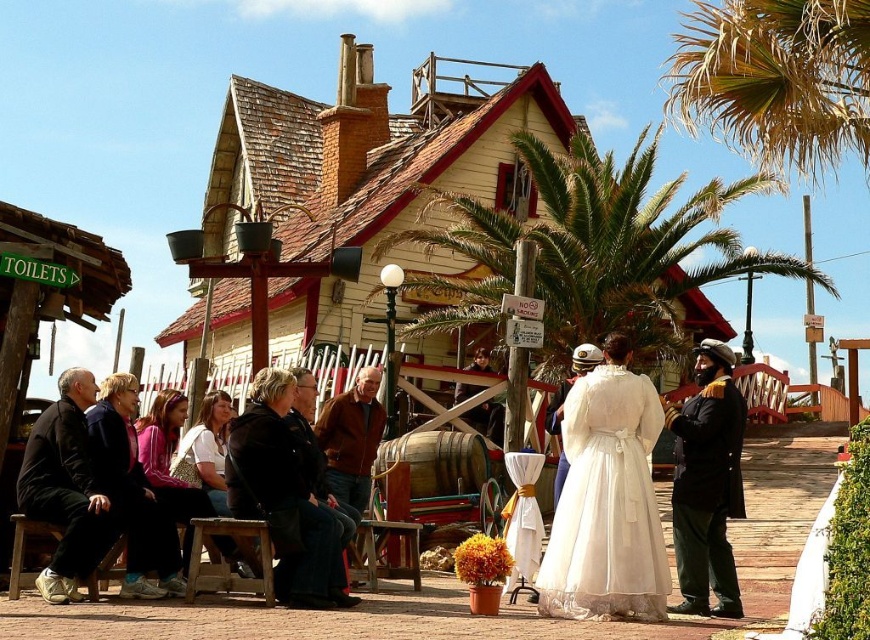
Question: Based on their relative distances, which object is nearer to the wooden picnic table at lower center?

Choices:
 (A) black fabric jacket at left
 (B) dark brown leather jacket at right
 (C) dark blue jeans at center

Answer: (C)

Question: Does dark blue jeans at center have a larger size compared to white fur coat at center?

Choices:
 (A) no
 (B) yes

Answer: (B)

Question: Does wooden picnic table at lower center appear under white fur coat at center?

Choices:
 (A) yes
 (B) no

Answer: (A)

Question: Estimate the real-world distances between objects in this image. Which object is closer to the brown leather jacket at center?

Choices:
 (A) green leafy palm tree at center
 (B) dark blue jeans at center
 (C) black leather jacket at center
 (D) dark brown leather jacket at right

Answer: (C)

Question: Can you confirm if brown leafy palm tree at upper right is positioned below black leather jacket at center?

Choices:
 (A) no
 (B) yes

Answer: (A)

Question: Which object is positioned closest to the black leather jacket at center?

Choices:
 (A) white satin dress at center
 (B) white fur coat at center
 (C) dark brown leather jacket at right
 (D) brown leather jacket at center

Answer: (D)